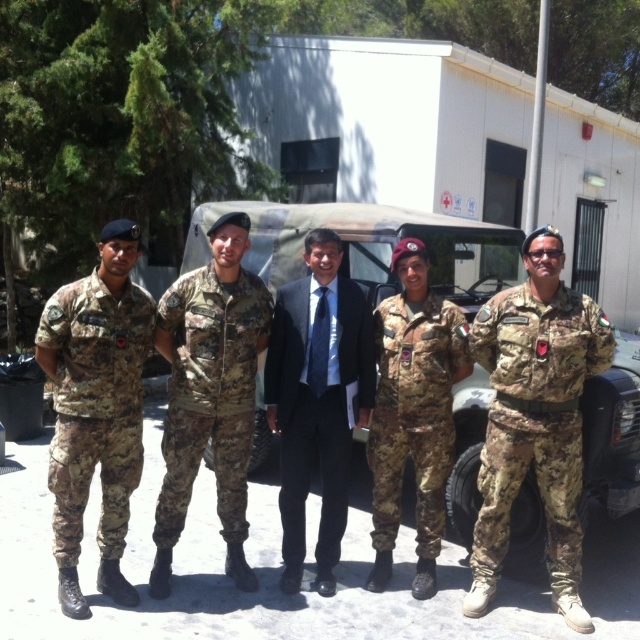
Question: Does camouflage fabric uniform at left have a greater width compared to camo fabric uniform at center?

Choices:
 (A) no
 (B) yes

Answer: (A)

Question: Is camouflage fabric uniform at right closer to the viewer compared to camouflage fabric uniform at left?

Choices:
 (A) yes
 (B) no

Answer: (B)

Question: Is camouflage fabric uniform at left thinner than camouflage fabric uniform at center?

Choices:
 (A) yes
 (B) no

Answer: (A)

Question: Which point is closer to the camera?

Choices:
 (A) (224, 316)
 (B) (321, 492)
 (C) (442, 316)

Answer: (A)

Question: Which object is closer to the camera taking this photo?

Choices:
 (A) camouflage fabric uniform at center
 (B) camouflage fabric uniform at right

Answer: (B)

Question: Based on their relative distances, which object is nearer to the camouflage fabric uniform at center?

Choices:
 (A) camouflage fabric uniform at left
 (B) camo fabric uniform at center
 (C) dark blue suit at center
 (D) camouflage fabric uniform at right

Answer: (C)